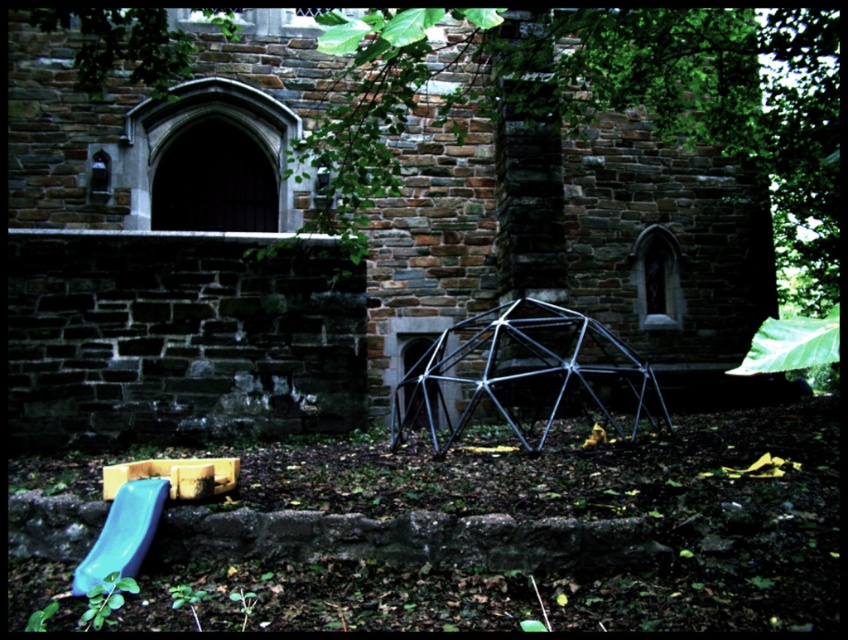
You are planning to place a new statue in the garden between the stone church at center and the metallic silver geodesic dome at center. Based on their widths, which structure should you position closer to the narrower one to ensure the statue fits properly?

The stone church at center might be wider than the metallic silver geodesic dome at center, so you should position the statue closer to the metallic silver geodesic dome at center to accommodate the narrower space.

You are standing at the entrance of the stone building and want to locate the metallic silver geodesic dome at center. According to the coordinates provided, in which direction should you walk to reach it?

The metallic silver geodesic dome at center is located at coordinates point (522, 374). Since you are at the entrance of the stone building, you should walk towards the center of the image to reach it.